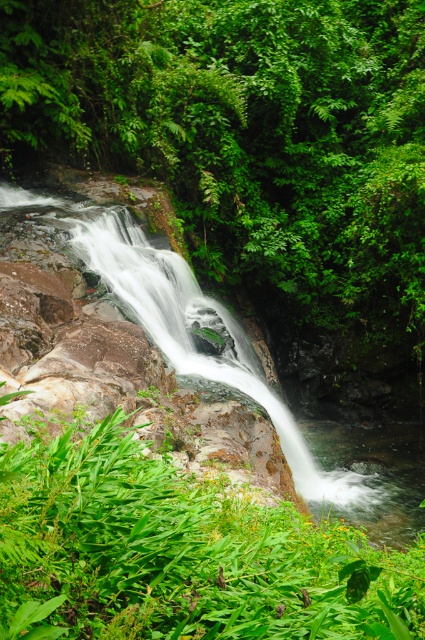
Question: Is green leafy tree at center to the right of green leafy plant at lower left from the viewer's perspective?

Choices:
 (A) no
 (B) yes

Answer: (A)

Question: Which point appears closest to the camera in this image?

Choices:
 (A) (255, 154)
 (B) (141, 300)
 (C) (68, 504)

Answer: (C)

Question: Can you confirm if green leafy tree at center is wider than smooth rock waterfall at center?

Choices:
 (A) no
 (B) yes

Answer: (A)

Question: Does green leafy plant at lower left appear on the right side of smooth rock waterfall at center?

Choices:
 (A) no
 (B) yes

Answer: (A)

Question: Which of the following is the closest to the observer?

Choices:
 (A) (82, 548)
 (B) (308, 458)
 (C) (340, 276)

Answer: (A)

Question: Which point is farther to the camera?

Choices:
 (A) (309, 465)
 (B) (73, 452)

Answer: (A)